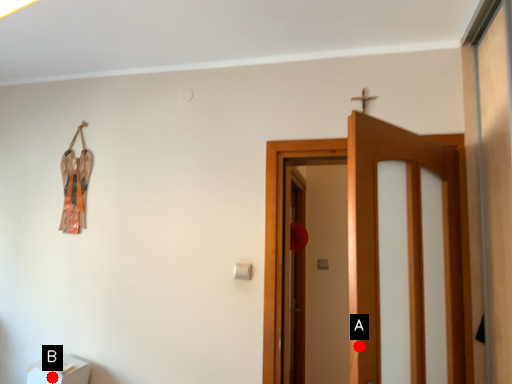
Question: Two points are circled on the image, labeled by A and B beside each circle. Which point is further to the camera?

Choices:
 (A) A is further
 (B) B is further

Answer: (B)